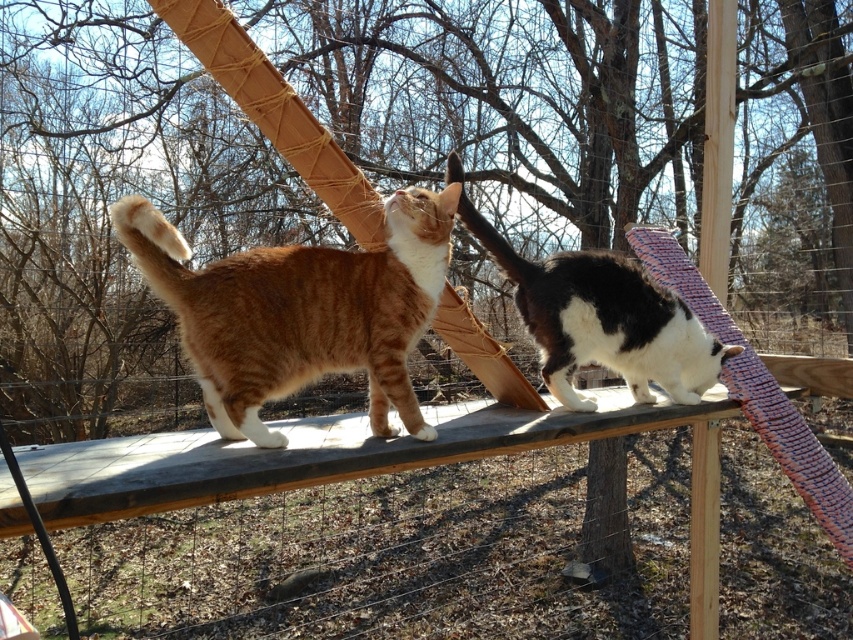
Question: Is orange tabby cat at center positioned in front of black and white fur cat at center?

Choices:
 (A) no
 (B) yes

Answer: (B)

Question: Is orange tabby cat at center bigger than black and white fur cat at center?

Choices:
 (A) yes
 (B) no

Answer: (B)

Question: Which of the following is the closest to the observer?

Choices:
 (A) (271, 298)
 (B) (634, 397)

Answer: (A)

Question: Does orange tabby cat at center have a greater width compared to black and white fur cat at center?

Choices:
 (A) yes
 (B) no

Answer: (B)

Question: Which object is closer to the camera taking this photo?

Choices:
 (A) black and white fur cat at center
 (B) orange tabby cat at center

Answer: (B)